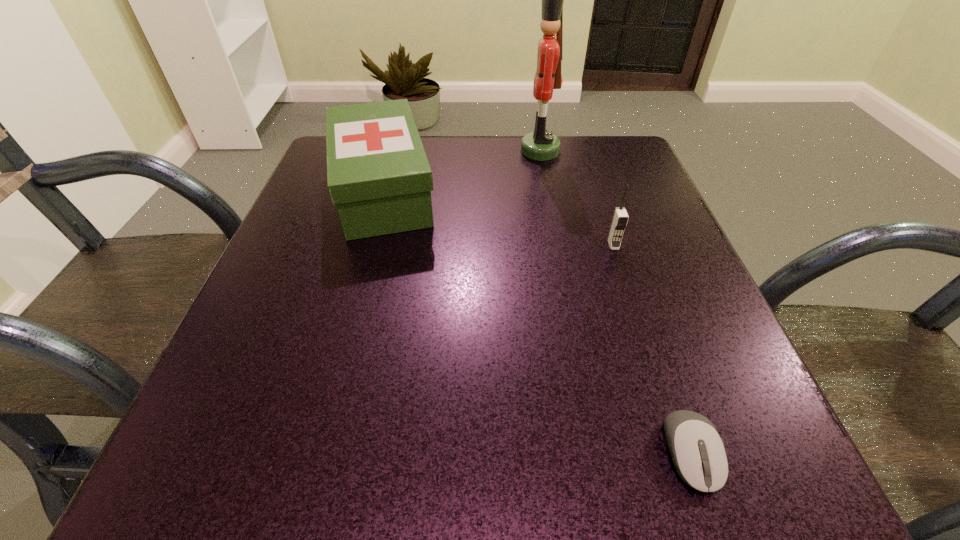
Find the location of a particular element. free space at the near edge of the desktop is located at coordinates (614, 429).

Where is `vacant area at the left edge of the desktop`? The height and width of the screenshot is (540, 960). vacant area at the left edge of the desktop is located at coordinates (278, 348).

In the image, there is a desktop. Identify the location of blank space at the right edge. (702, 351).

In the image, there is a desktop. Where is `vacant space at the near left corner`? The height and width of the screenshot is (540, 960). vacant space at the near left corner is located at coordinates (273, 433).

Locate an element on the screen. vacant space at the far right corner of the desktop is located at coordinates (627, 156).

This screenshot has width=960, height=540. I want to click on free space at the near right corner of the desktop, so click(668, 474).

I want to click on vacant space in between the cellular telephone and the leftmost object, so click(498, 218).

You are a GUI agent. You are given a task and a screenshot of the screen. Output one action in this format:
    pyautogui.click(x=<x>, y=<y>)
    Task: Click on the free space that is in between the cellular telephone and the shortest object
    This screenshot has width=960, height=540.
    Given the screenshot: What is the action you would take?
    pyautogui.click(x=652, y=349)

At what (x,y) coordinates should I click in order to perform the action: click on free space between the second object from left to right and the nearest object. Please return your answer as a coordinate pair (x, y). Looking at the image, I should click on (615, 302).

You are a GUI agent. You are given a task and a screenshot of the screen. Output one action in this format:
    pyautogui.click(x=<x>, y=<y>)
    Task: Click on the vacant point located between the nutcracker and the nearest object
    The width and height of the screenshot is (960, 540).
    Given the screenshot: What is the action you would take?
    pyautogui.click(x=615, y=302)